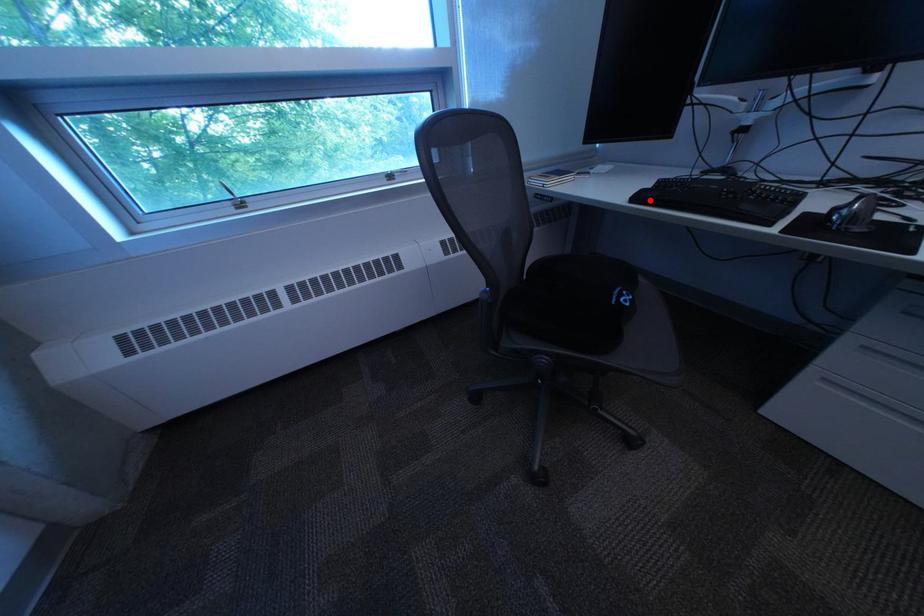
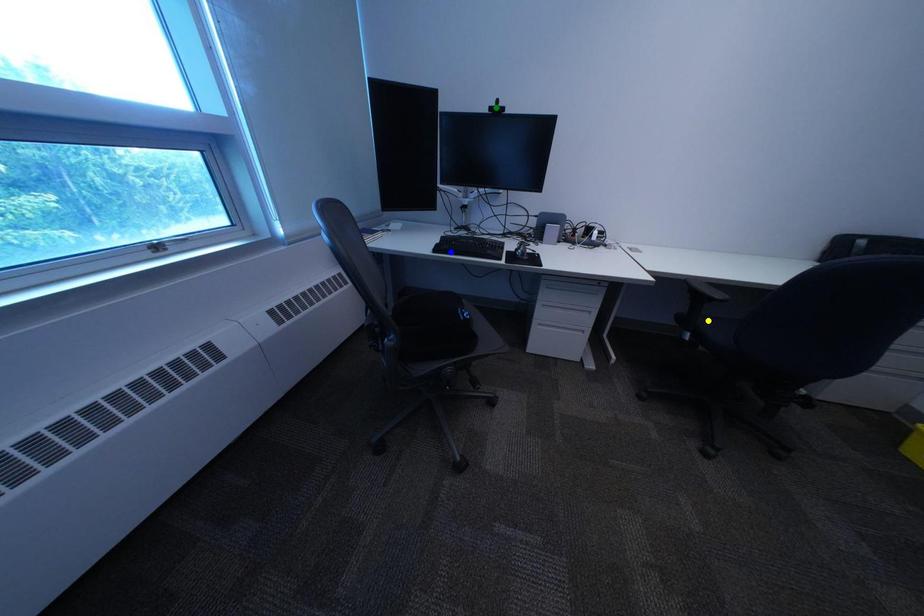
Question: I am providing you with two images of the same scene from different viewpoints. A red point is marked on the first image. You are given multiple points on the second image. Which point in image 2 is actually the same real-world point as the red point in image 1?

Choices:
 (A) yellow point
 (B) blue point
 (C) green point

Answer: (B)